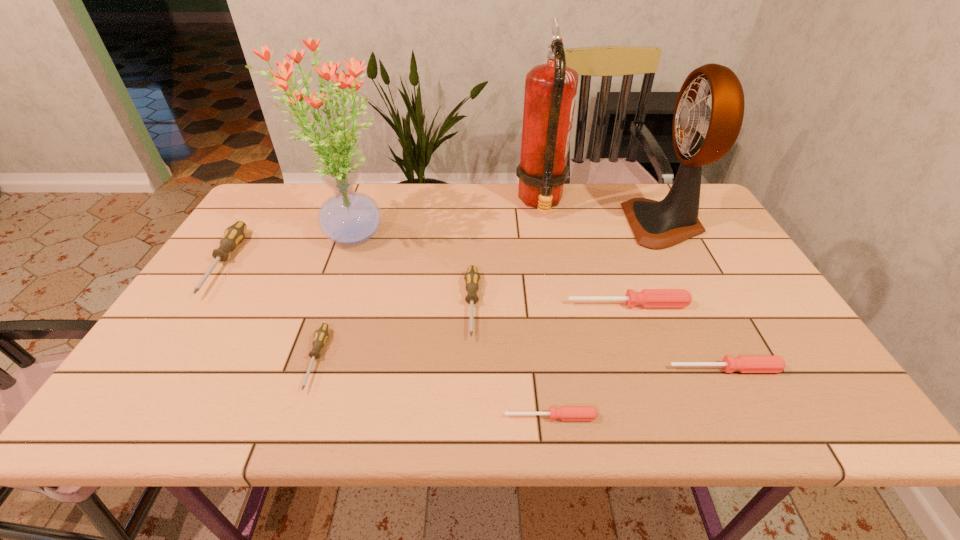
Where is `vacant area that lies between the farthest red screwdriver and the flower arrangement`? This screenshot has width=960, height=540. vacant area that lies between the farthest red screwdriver and the flower arrangement is located at coordinates (489, 269).

This screenshot has height=540, width=960. I want to click on free point between the second biggest red screwdriver and the fire extinguisher, so click(633, 286).

Find the location of a particular element. Image resolution: width=960 pixels, height=540 pixels. free area in between the leftmost screwdriver and the nearest red screwdriver is located at coordinates (388, 340).

Identify the location of free space between the smallest red screwdriver and the second smallest red screwdriver. The height and width of the screenshot is (540, 960). (637, 393).

Where is `free spot between the fan and the second biggest red screwdriver`? This screenshot has width=960, height=540. free spot between the fan and the second biggest red screwdriver is located at coordinates (694, 296).

Where is `unoccupied area between the second biggest red screwdriver and the red fire extinguisher`? unoccupied area between the second biggest red screwdriver and the red fire extinguisher is located at coordinates (633, 286).

Image resolution: width=960 pixels, height=540 pixels. I want to click on free space between the fire extinguisher and the brown fan, so click(x=602, y=213).

This screenshot has width=960, height=540. Identify the location of the second closest object to the flower arrangement. click(x=472, y=278).

The image size is (960, 540). What are the coordinates of `the seventh closest object to the leftmost gray screwdriver` in the screenshot? It's located at 743,363.

In order to click on screwdriver that stands as the sixth closest to the brown fan in this screenshot , I will do `click(234, 234)`.